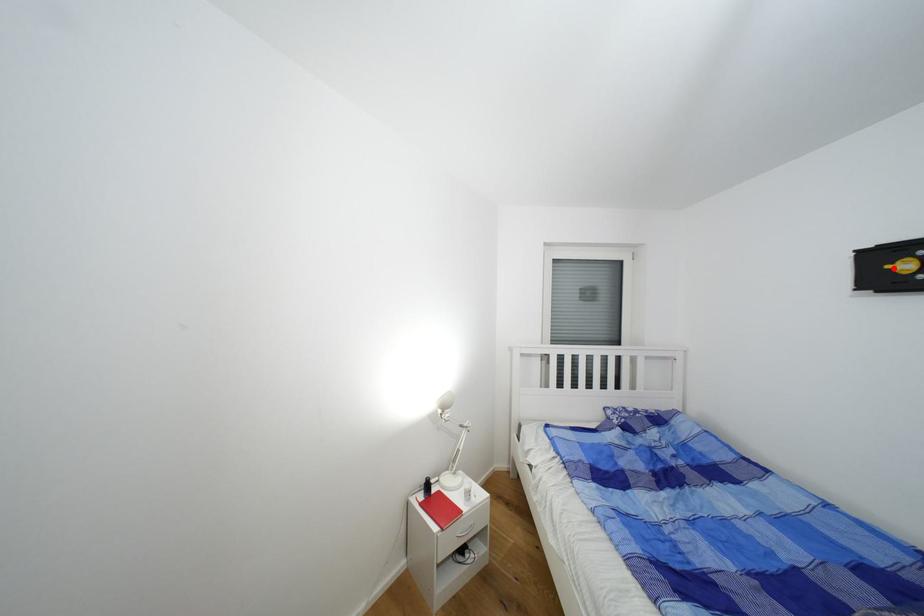
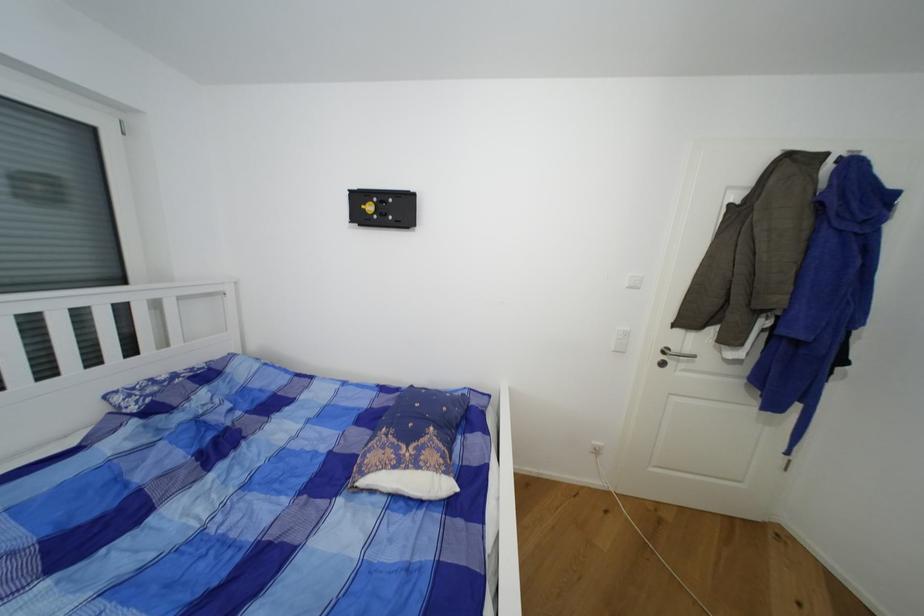
The point at the highlighted location is marked in the first image. Where is the corresponding point in the second image?

(369, 208)